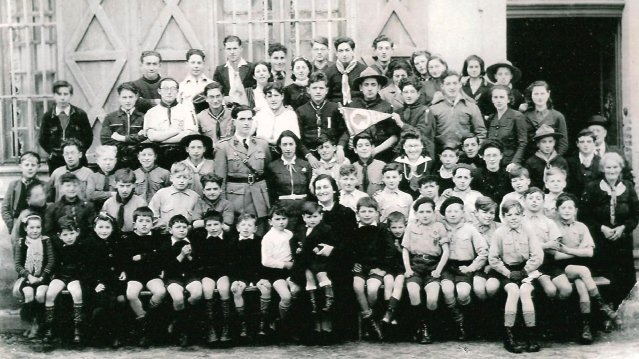
Where is `triangles on wall`? This screenshot has height=359, width=639. triangles on wall is located at coordinates (393, 11), (174, 18), (93, 21), (93, 89).